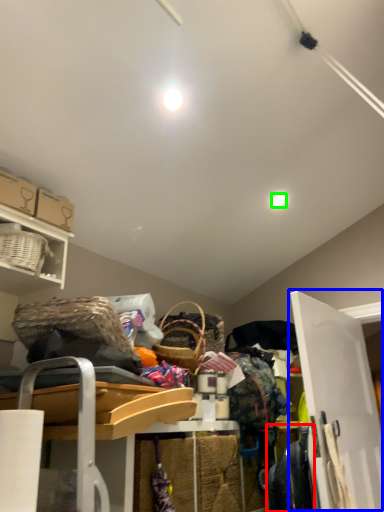
Question: Based on their relative distances, which object is nearer to clothing (highlighted by a red box)? Choose from door (highlighted by a blue box) and light (highlighted by a green box).

Choices:
 (A) door
 (B) light

Answer: (A)